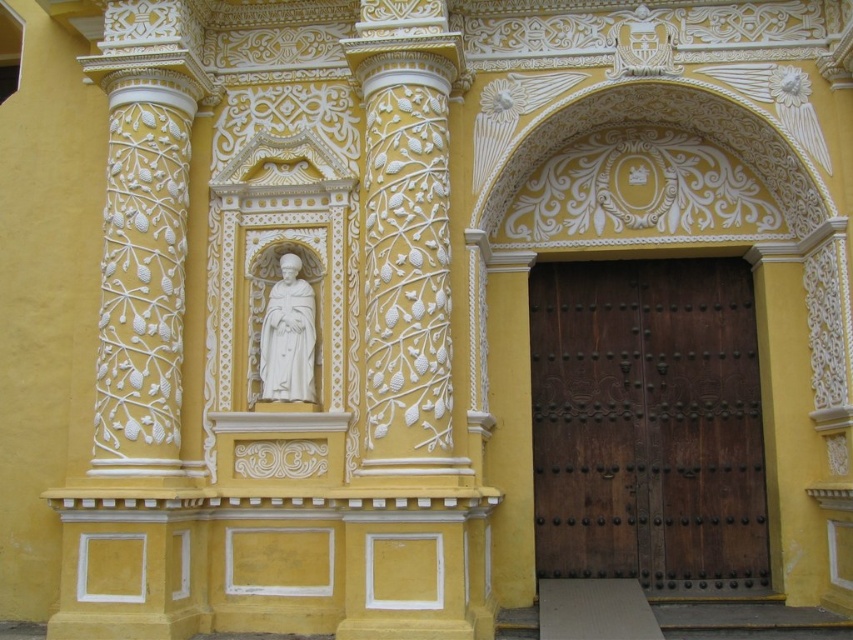
In the scene shown: You are standing in front of the building and want to enter through the dark brown wood door at center. Is the white marble statue at center blocking your path to the door?

The dark brown wood door at center is closer to you than the white marble statue at center, so the statue is not blocking your path to the door.

Looking at this image, you are standing in front of the building and want to enter through the dark brown wood door at center. Which direction should you walk relative to the white marble statue at center?

The dark brown wood door at center is to the right of the white marble statue at center, so you should walk to the right of the white marble statue at center to reach the dark brown wood door at center.